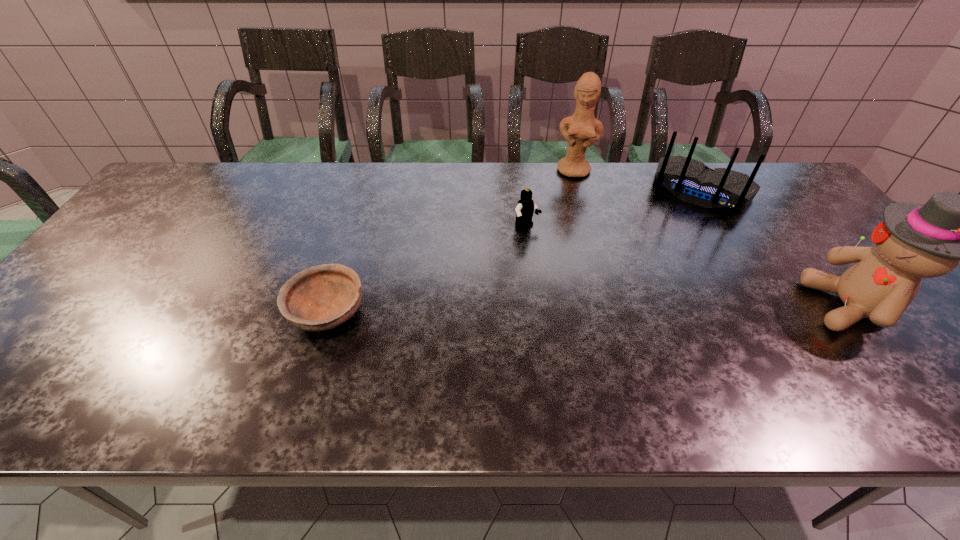
The width and height of the screenshot is (960, 540). What are the coordinates of `vacant spot on the desktop that is between the bowl and the rag_doll and is positioned on the front-facing side of the second shortest object` in the screenshot? It's located at (628, 309).

Find the location of a particular element. The image size is (960, 540). free space on the desktop that is between the shortest object and the rag_doll and is positioned on the front-facing side of the third object from right to left is located at coordinates (559, 310).

Where is `free space on the desktop that is between the leftmost object and the rag_doll and is positioned on the back of the router`? The width and height of the screenshot is (960, 540). free space on the desktop that is between the leftmost object and the rag_doll and is positioned on the back of the router is located at coordinates (642, 309).